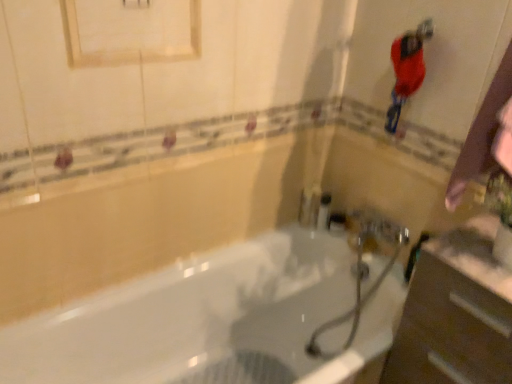
Question: Does white glossy bathtub at center have a lesser height compared to metallic silver faucet at center?

Choices:
 (A) no
 (B) yes

Answer: (A)

Question: Is white glossy bathtub at center facing away from metallic silver faucet at center?

Choices:
 (A) yes
 (B) no

Answer: (B)

Question: Can you confirm if white glossy bathtub at center is bigger than metallic silver faucet at center?

Choices:
 (A) no
 (B) yes

Answer: (B)

Question: Is white glossy bathtub at center smaller than metallic silver faucet at center?

Choices:
 (A) yes
 (B) no

Answer: (B)

Question: Is metallic silver faucet at center completely or partially inside white glossy bathtub at center?

Choices:
 (A) no
 (B) yes

Answer: (A)

Question: Does point (321, 251) appear closer or farther from the camera than point (394, 51)?

Choices:
 (A) closer
 (B) farther

Answer: (B)

Question: From a real-world perspective, is white glossy bathtub at center above or below shiny red hairbrush at upper right?

Choices:
 (A) above
 (B) below

Answer: (B)

Question: Considering their positions, is white glossy bathtub at center located in front of or behind shiny red hairbrush at upper right?

Choices:
 (A) behind
 (B) front

Answer: (B)

Question: Looking at their shapes, would you say white glossy bathtub at center is wider or thinner than shiny red hairbrush at upper right?

Choices:
 (A) wide
 (B) thin

Answer: (A)

Question: From a real-world perspective, is white matte medicine cabinet at upper center physically located above or below white glossy bathtub at center?

Choices:
 (A) above
 (B) below

Answer: (A)

Question: Relative to white glossy bathtub at center, is white matte medicine cabinet at upper center in front or behind?

Choices:
 (A) front
 (B) behind

Answer: (B)

Question: Would you say white matte medicine cabinet at upper center is inside or outside white glossy bathtub at center?

Choices:
 (A) inside
 (B) outside

Answer: (B)

Question: Looking at their shapes, would you say white matte medicine cabinet at upper center is wider or thinner than white glossy bathtub at center?

Choices:
 (A) wide
 (B) thin

Answer: (B)

Question: Considering the positions of white matte medicine cabinet at upper center and shiny red hairbrush at upper right in the image, is white matte medicine cabinet at upper center bigger or smaller than shiny red hairbrush at upper right?

Choices:
 (A) small
 (B) big

Answer: (B)

Question: In terms of height, does white matte medicine cabinet at upper center look taller or shorter compared to shiny red hairbrush at upper right?

Choices:
 (A) short
 (B) tall

Answer: (A)